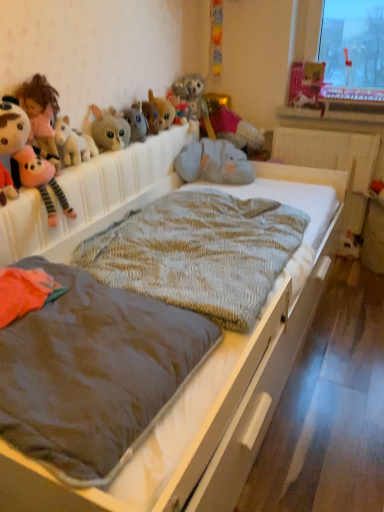
Question: Is matte pink castle at upper right, which is the eighth toy from left to right, wider than knitted woolen blanket at center, which is counted as the second blanket, starting from the back?

Choices:
 (A) yes
 (B) no

Answer: (B)

Question: Is matte pink castle at upper right, placed as the 1th toy when sorted from right to left, located outside knitted woolen blanket at center, which is counted as the second blanket, starting from the back?

Choices:
 (A) no
 (B) yes

Answer: (B)

Question: Is matte pink castle at upper right, which is the eighth toy from left to right, facing towards knitted woolen blanket at center, the first blanket in the front-to-back sequence?

Choices:
 (A) no
 (B) yes

Answer: (B)

Question: Can you confirm if matte pink castle at upper right, placed as the 1th toy when sorted from right to left, is bigger than knitted woolen blanket at center, the first blanket in the front-to-back sequence?

Choices:
 (A) yes
 (B) no

Answer: (B)

Question: Would you say knitted woolen blanket at center, which is counted as the second blanket, starting from the back, is part of matte pink castle at upper right, which is the eighth toy from left to right,'s contents?

Choices:
 (A) no
 (B) yes

Answer: (A)

Question: From the image's perspective, is matte pink castle at upper right, which is the eighth toy from left to right, under knitted woolen blanket at center, which is counted as the second blanket, starting from the back?

Choices:
 (A) yes
 (B) no

Answer: (B)

Question: Does velvet pink pillow at upper center, placed as the 2th toy when sorted from right to left, lie behind fuzzy fabric bunny at upper center, which is counted as the fifth toy, starting from the left?

Choices:
 (A) no
 (B) yes

Answer: (B)

Question: Does velvet pink pillow at upper center, which is counted as the 7th toy, starting from the left, have a larger size compared to fuzzy fabric bunny at upper center, which ranks as the 4th toy in right-to-left order?

Choices:
 (A) no
 (B) yes

Answer: (B)

Question: From the image's perspective, is velvet pink pillow at upper center, placed as the 2th toy when sorted from right to left, beneath fuzzy fabric bunny at upper center, which is counted as the fifth toy, starting from the left?

Choices:
 (A) yes
 (B) no

Answer: (B)

Question: From a real-world perspective, is velvet pink pillow at upper center, which is counted as the 7th toy, starting from the left, physically above fuzzy fabric bunny at upper center, which is counted as the fifth toy, starting from the left?

Choices:
 (A) yes
 (B) no

Answer: (B)

Question: Is velvet pink pillow at upper center, which is counted as the 7th toy, starting from the left, looking in the opposite direction of fuzzy fabric bunny at upper center, which is counted as the fifth toy, starting from the left?

Choices:
 (A) yes
 (B) no

Answer: (B)

Question: Considering the relative sizes of velvet pink pillow at upper center, placed as the 2th toy when sorted from right to left, and fuzzy fabric bunny at upper center, which is counted as the fifth toy, starting from the left, in the image provided, is velvet pink pillow at upper center, placed as the 2th toy when sorted from right to left, taller than fuzzy fabric bunny at upper center, which is counted as the fifth toy, starting from the left,?

Choices:
 (A) yes
 (B) no

Answer: (A)

Question: From the image's perspective, would you say matte pink castle at upper right, placed as the 1th toy when sorted from right to left, is shown under knitted woolen blanket at center, which is counted as the 2th blanket, starting from the front?

Choices:
 (A) no
 (B) yes

Answer: (A)